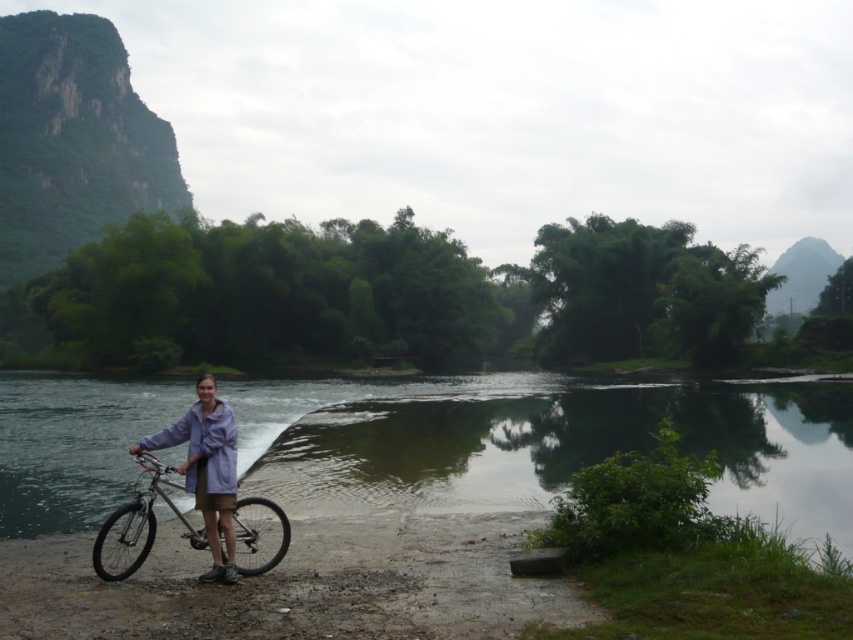
Question: Is green reflective water at center wider than light purple fabric shirt at center?

Choices:
 (A) no
 (B) yes

Answer: (B)

Question: Does green reflective water at center appear over light purple fabric shirt at center?

Choices:
 (A) no
 (B) yes

Answer: (A)

Question: Which point is closer to the camera?

Choices:
 (A) light purple fabric shirt at center
 (B) green reflective water at center

Answer: (A)

Question: Which point is farther to the camera?

Choices:
 (A) (282, 520)
 (B) (364, 502)
 (C) (157, 442)

Answer: (B)

Question: Which point is closer to the camera?

Choices:
 (A) (207, 403)
 (B) (283, 525)
 (C) (805, 384)

Answer: (A)

Question: In this image, where is green reflective water at center located relative to light purple fabric shirt at center?

Choices:
 (A) below
 (B) above

Answer: (A)